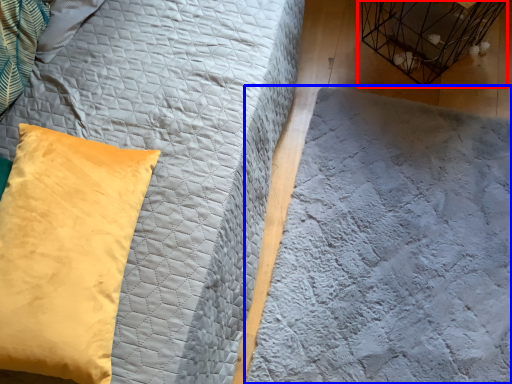
Question: Which object appears farthest to the camera in this image, bird cage (highlighted by a red box) or sheet (highlighted by a blue box)?

Choices:
 (A) bird cage
 (B) sheet

Answer: (A)